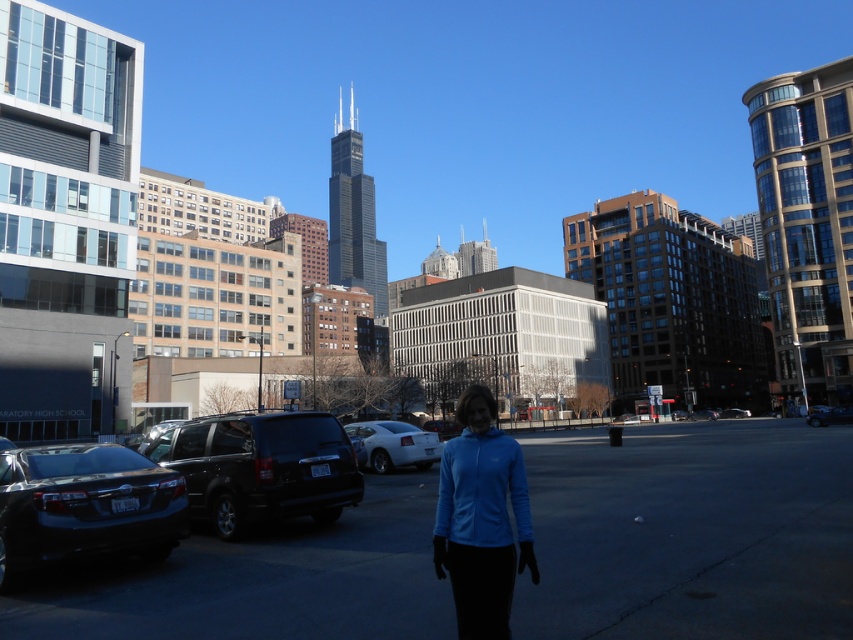
You are standing at a point in the urban scene. There is a point marked at coordinates point (337, 449). If you want to place a 10 meter long banner from your current position to that point, will it reach?

The distance of point (337, 449) from viewer is 9.75 meters, so the 10 meter long banner will reach the point.